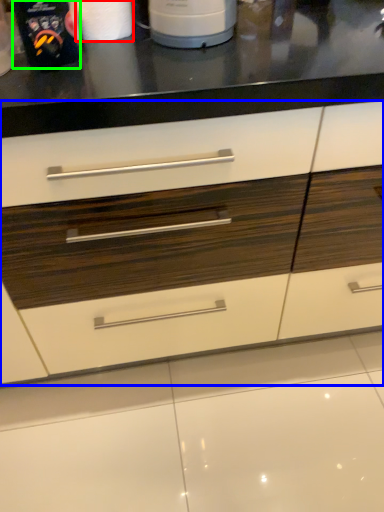
Question: Which is nearer to the paper towel (highlighted by a red box)? drawer (highlighted by a blue box) or kitchen appliance (highlighted by a green box).

Choices:
 (A) drawer
 (B) kitchen appliance

Answer: (B)